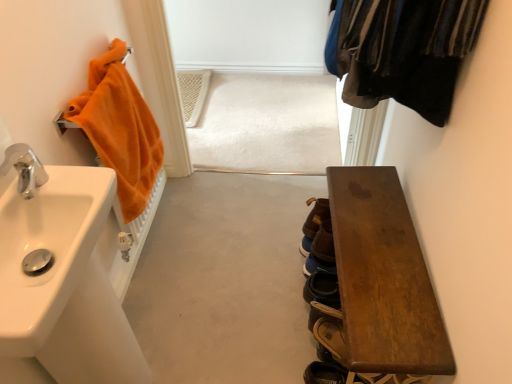
The image size is (512, 384). Describe the element at coordinates (317, 265) in the screenshot. I see `brown leather shoe at lower right, marked as the 2th shoe in a top-to-bottom arrangement` at that location.

The image size is (512, 384). In order to click on brown leather shoe at lower right, the third shoe viewed from the back in this screenshot , I will do `click(324, 373)`.

This screenshot has height=384, width=512. What do you see at coordinates (24, 169) in the screenshot? I see `silver metallic faucet at left` at bounding box center [24, 169].

The width and height of the screenshot is (512, 384). In order to click on brown leather shoe at lower right, positioned as the 3th shoe in front-to-back order in this screenshot , I will do `click(317, 265)`.

From a real-world perspective, between brown suede shoe at lower center, the second shoe viewed from the front, and white glossy sink at left, who is vertically lower?

brown suede shoe at lower center, the second shoe viewed from the front.

Measure the distance between brown suede shoe at lower center, positioned as the 3th shoe in bottom-to-top order, and white glossy sink at left.

A distance of 38.64 inches exists between brown suede shoe at lower center, positioned as the 3th shoe in bottom-to-top order, and white glossy sink at left.

Where is `the 3rd shoe to the right of the white glossy sink at left, counting from the anchor's position`? The image size is (512, 384). the 3rd shoe to the right of the white glossy sink at left, counting from the anchor's position is located at coordinates (313, 222).

Considering the sizes of objects brown suede shoe at lower center, which ranks as the 2th shoe in back-to-front order, and white glossy sink at left in the image provided, who is taller, brown suede shoe at lower center, which ranks as the 2th shoe in back-to-front order, or white glossy sink at left?

With more height is brown suede shoe at lower center, which ranks as the 2th shoe in back-to-front order.

Does wooden bench at lower right touch brown leather shoe at lower right, which is the first shoe from back to front?

No, wooden bench at lower right is not touching brown leather shoe at lower right, which is the first shoe from back to front.

Is wooden bench at lower right smaller than brown leather shoe at lower right, placed as the second shoe when sorted from bottom to top?

Actually, wooden bench at lower right might be larger than brown leather shoe at lower right, placed as the second shoe when sorted from bottom to top.

From a real-world perspective, who is located lower, wooden bench at lower right or brown leather shoe at lower right, placed as the second shoe when sorted from bottom to top?

brown leather shoe at lower right, placed as the second shoe when sorted from bottom to top.

Does wooden bench at lower right appear on the right side of brown leather shoe at lower right, placed as the second shoe when sorted from bottom to top?

Yes.

Looking at this image, can we say silver metallic faucet at left lies outside wooden bench at lower right?

Yes.

Which object is further away from the camera, silver metallic faucet at left or wooden bench at lower right?

wooden bench at lower right is further away from the camera.

From a real-world perspective, which is physically below, silver metallic faucet at left or wooden bench at lower right?

wooden bench at lower right.

Is point (29, 155) positioned after point (373, 302)?

No, it is not.

Does wooden bench at lower right lie behind silver metallic faucet at left?

Yes.

Is wooden bench at lower right bigger than silver metallic faucet at left?

Indeed, wooden bench at lower right has a larger size compared to silver metallic faucet at left.

In the image, is wooden bench at lower right on the left side or the right side of silver metallic faucet at left?

wooden bench at lower right is to the right of silver metallic faucet at left.

Where is `furniture that is behind the silver metallic faucet at left`? The image size is (512, 384). furniture that is behind the silver metallic faucet at left is located at coordinates (383, 278).

Considering their positions, is white glossy sink at left located in front of or behind silver metallic faucet at left?

Clearly, white glossy sink at left is in front of silver metallic faucet at left.

How different are the orientations of white glossy sink at left and silver metallic faucet at left in degrees?

0.00919 degrees separate the facing orientations of white glossy sink at left and silver metallic faucet at left.

Can you confirm if white glossy sink at left is smaller than silver metallic faucet at left?

No.

Is white glossy sink at left completely or partially outside of silver metallic faucet at left?

white glossy sink at left is positioned outside silver metallic faucet at left.

Visually, is white glossy sink at left positioned to the left or to the right of brown leather shoe at lower right, the third shoe viewed from the back?

From the image, it's evident that white glossy sink at left is to the left of brown leather shoe at lower right, the third shoe viewed from the back.

Which is behind, white glossy sink at left or brown leather shoe at lower right, the third shoe viewed from the back?

brown leather shoe at lower right, the third shoe viewed from the back, is more distant.

Is brown leather shoe at lower right, the 3th shoe when ordered from top to bottom, surrounded by white glossy sink at left?

No, brown leather shoe at lower right, the 3th shoe when ordered from top to bottom, is not surrounded by white glossy sink at left.

Who is smaller, white glossy sink at left or brown leather shoe at lower right, the 1th shoe when ordered from front to back?

Smaller between the two is brown leather shoe at lower right, the 1th shoe when ordered from front to back.

From the image's perspective, starting from the orange terry cloth towel at left, which shoe is the 1st one below? Please provide its 2D coordinates.

[(313, 222)]

How many degrees apart are the facing directions of brown suede shoe at lower center, positioned as the 3th shoe in bottom-to-top order, and orange terry cloth towel at left?

brown suede shoe at lower center, positioned as the 3th shoe in bottom-to-top order, and orange terry cloth towel at left are facing 179 degrees away from each other.

From a real-world perspective, is brown suede shoe at lower center, the second shoe viewed from the front, physically above orange terry cloth towel at left?

Incorrect, from a real-world perspective, brown suede shoe at lower center, the second shoe viewed from the front, is lower than orange terry cloth towel at left.

Is brown suede shoe at lower center, which ranks as the 2th shoe in back-to-front order, turned away from orange terry cloth towel at left?

No.

The height and width of the screenshot is (384, 512). In order to click on sink that is below the brown suede shoe at lower center, which is the first shoe from top to bottom (from the image's perspective) in this screenshot , I will do `click(45, 241)`.

You are a GUI agent. You are given a task and a screenshot of the screen. Output one action in this format:
    pyautogui.click(x=<x>, y=<y>)
    Task: Click on the shoe that is the 1st object located above the wooden bench at lower right (from the image's perspective)
    This screenshot has width=512, height=384.
    Given the screenshot: What is the action you would take?
    pyautogui.click(x=317, y=265)

In the scene shown: Considering their positions, is orange terry cloth towel at left positioned closer to white glossy sink at left than silver metallic faucet at left?

The object closer to white glossy sink at left is silver metallic faucet at left.

Estimate the real-world distances between objects in this image. Which object is further from silver metallic faucet at left, orange terry cloth towel at left or brown leather shoe at lower right, positioned as the 3th shoe in front-to-back order?

brown leather shoe at lower right, positioned as the 3th shoe in front-to-back order, is positioned further to the anchor silver metallic faucet at left.

Which object lies nearer to the anchor point brown leather shoe at lower right, the 3th shoe when ordered from top to bottom, orange terry cloth towel at left or white glossy sink at left?

The object closer to brown leather shoe at lower right, the 3th shoe when ordered from top to bottom, is white glossy sink at left.

Which object lies nearer to the anchor point brown leather shoe at lower right, positioned as the 3th shoe in front-to-back order, white glossy sink at left or silver metallic faucet at left?

white glossy sink at left.

From the image, which object appears to be nearer to orange terry cloth towel at left, silver metallic faucet at left or wooden bench at lower right?

silver metallic faucet at left is positioned closer to the anchor orange terry cloth towel at left.

Which object lies nearer to the anchor point wooden bench at lower right, brown leather shoe at lower right, placed as the second shoe when sorted from bottom to top, or orange terry cloth towel at left?

brown leather shoe at lower right, placed as the second shoe when sorted from bottom to top.

When comparing their distances from brown suede shoe at lower center, which is the first shoe from top to bottom, does silver metallic faucet at left or brown leather shoe at lower right, which is counted as the first shoe, starting from the bottom, seem closer?

brown leather shoe at lower right, which is counted as the first shoe, starting from the bottom, is closer to brown suede shoe at lower center, which is the first shoe from top to bottom.

From the image, which object appears to be farther from orange terry cloth towel at left, silver metallic faucet at left or brown suede shoe at lower center, which is the first shoe from top to bottom?

brown suede shoe at lower center, which is the first shoe from top to bottom, is further to orange terry cloth towel at left.

Where is `bath towel between silver metallic faucet at left and wooden bench at lower right`? This screenshot has height=384, width=512. bath towel between silver metallic faucet at left and wooden bench at lower right is located at coordinates (120, 129).

At what (x,y) coordinates should I click in order to perform the action: click on sink situated between silver metallic faucet at left and brown leather shoe at lower right, the third shoe viewed from the back, from left to right. Please return your answer as a coordinate pair (x, y). Looking at the image, I should click on (45, 241).

Where is `bath towel between white glossy sink at left and brown suede shoe at lower center, positioned as the 3th shoe in bottom-to-top order, from left to right`? This screenshot has height=384, width=512. bath towel between white glossy sink at left and brown suede shoe at lower center, positioned as the 3th shoe in bottom-to-top order, from left to right is located at coordinates (120, 129).

Identify the location of shoe between wooden bench at lower right and brown suede shoe at lower center, the second shoe viewed from the front, in the front-back direction. The height and width of the screenshot is (384, 512). (324, 373).